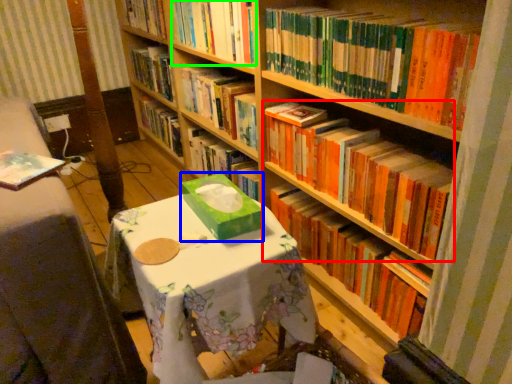
Question: Based on their relative distances, which object is nearer to book (highlighted by a red box)? Choose from cardboard box (highlighted by a blue box) and book (highlighted by a green box).

Choices:
 (A) cardboard box
 (B) book

Answer: (A)